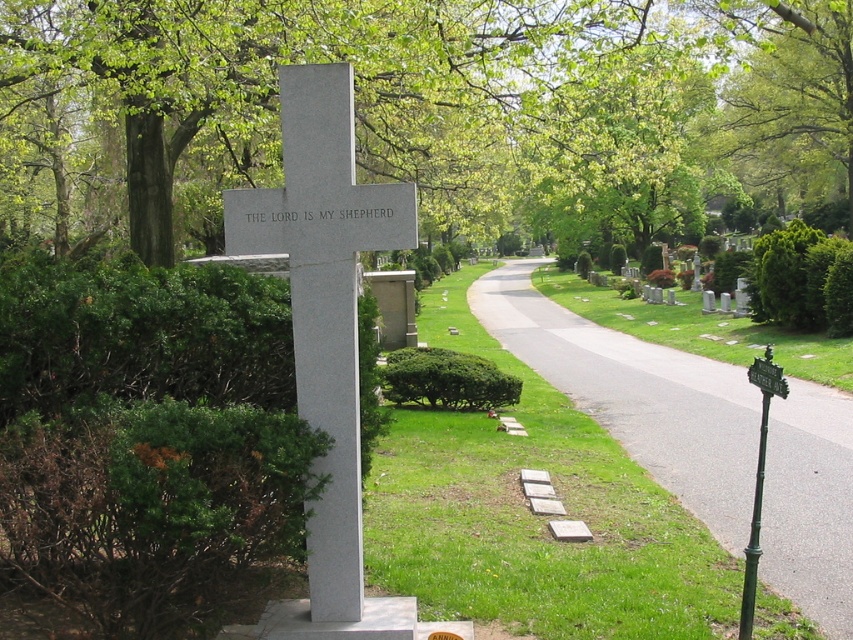
Question: Which point is farther from the camera taking this photo?

Choices:
 (A) (820, 500)
 (B) (297, 211)

Answer: (A)

Question: Is green leafy tree at upper left to the right of asphalt road at center from the viewer's perspective?

Choices:
 (A) yes
 (B) no

Answer: (B)

Question: Is green leafy tree at upper left closer to the viewer compared to asphalt road at center?

Choices:
 (A) yes
 (B) no

Answer: (A)

Question: Which object is closer to the camera taking this photo?

Choices:
 (A) asphalt road at center
 (B) green leafy tree at upper left
 (C) white polished stone cross at center

Answer: (C)

Question: Which point is closer to the camera?

Choices:
 (A) (605, 369)
 (B) (376, 189)
 (C) (173, 161)

Answer: (B)

Question: Considering the relative positions of green leafy tree at upper left and asphalt road at center in the image provided, where is green leafy tree at upper left located with respect to asphalt road at center?

Choices:
 (A) left
 (B) right

Answer: (A)